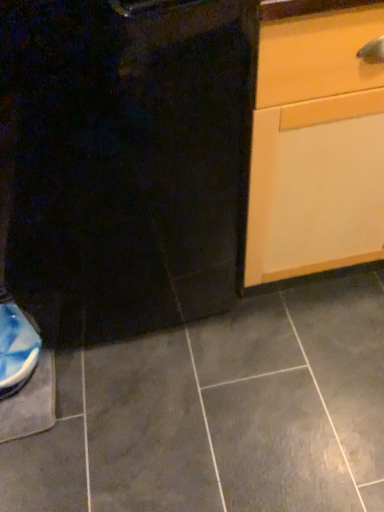
Locate an element on the screen. light wood cabinet at right is located at coordinates (316, 147).

What do you see at coordinates (316, 147) in the screenshot? I see `light wood cabinet at right` at bounding box center [316, 147].

The height and width of the screenshot is (512, 384). I want to click on light wood cabinet at right, so click(316, 147).